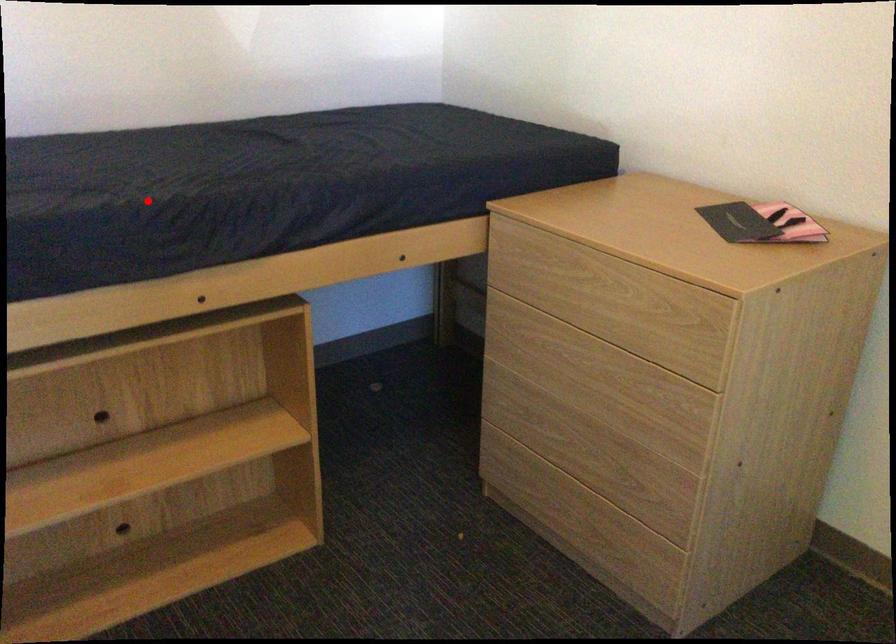
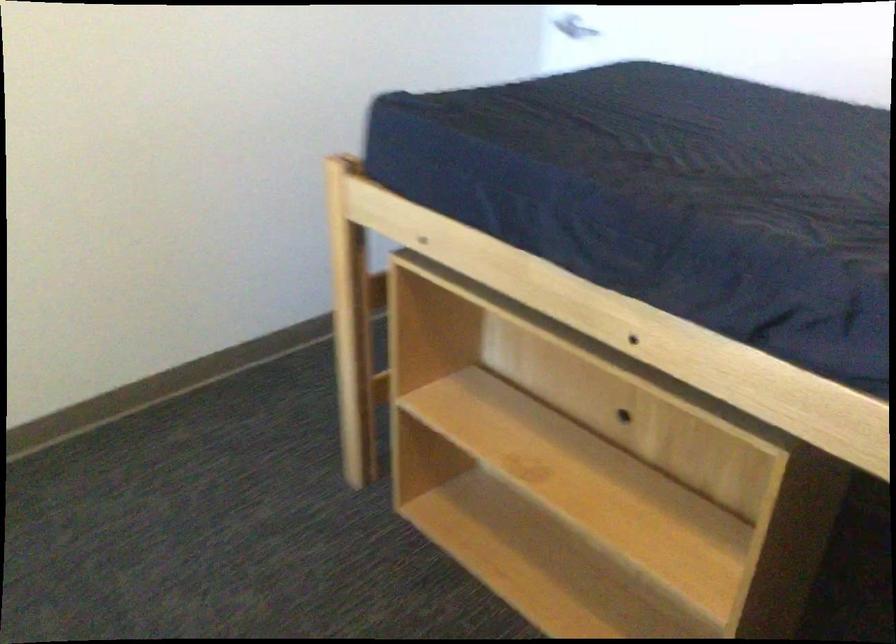
Question: A red point is marked in image1. In image2, is the corresponding 3D point closer to the camera or farther? Reply with the corresponding letter.

Choices:
 (A) The corresponding 3D point is closer.
 (B) The corresponding 3D point is farther.

Answer: (A)